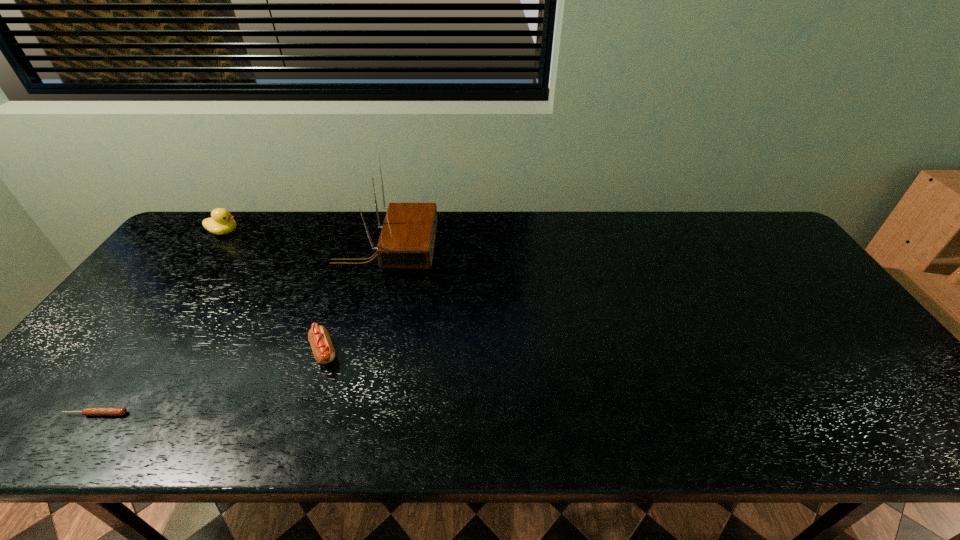
At what (x,y) coordinates should I click in order to perform the action: click on radio_receiver at the far edge. Please return your answer as a coordinate pair (x, y). Image resolution: width=960 pixels, height=540 pixels. Looking at the image, I should click on (407, 238).

This screenshot has width=960, height=540. In order to click on duckling that is at the far edge in this screenshot , I will do `click(221, 222)`.

Where is `object that is at the near edge`? object that is at the near edge is located at coordinates (86, 411).

The height and width of the screenshot is (540, 960). I want to click on duckling at the left edge, so click(221, 222).

The height and width of the screenshot is (540, 960). What are the coordinates of `sausage that is at the left edge` in the screenshot? It's located at (86, 411).

Image resolution: width=960 pixels, height=540 pixels. In order to click on object situated at the far left corner in this screenshot , I will do `click(221, 222)`.

Locate an element on the screen. object that is at the near left corner is located at coordinates (86, 411).

In the image, there is a desktop. Where is `vacant space at the far edge`? Image resolution: width=960 pixels, height=540 pixels. vacant space at the far edge is located at coordinates (505, 215).

Image resolution: width=960 pixels, height=540 pixels. Find the location of `vacant area at the near edge`. vacant area at the near edge is located at coordinates (654, 424).

This screenshot has height=540, width=960. Find the location of `free space at the left edge of the desktop`. free space at the left edge of the desktop is located at coordinates (101, 402).